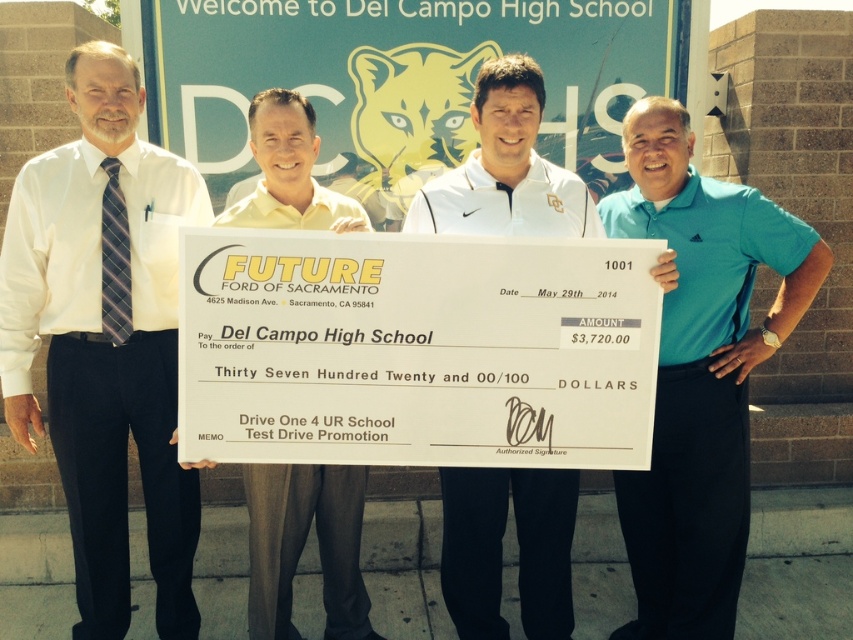
Can you confirm if white matte shirt at center is positioned to the left of yellow shirt at center?

Incorrect, white matte shirt at center is not on the left side of yellow shirt at center.

You are a GUI agent. You are given a task and a screenshot of the screen. Output one action in this format:
    pyautogui.click(x=<x>, y=<y>)
    Task: Click on the white matte shirt at center
    This screenshot has height=640, width=853.
    Given the screenshot: What is the action you would take?
    pyautogui.click(x=502, y=548)

Can you confirm if teal polo shirt at right is thinner than yellow shirt at center?

Incorrect, teal polo shirt at right's width is not less than yellow shirt at center's.

Who is higher up, teal polo shirt at right or yellow shirt at center?

teal polo shirt at right is higher up.

In the scene shown: Who is more distant from viewer, [668,579] or [341,630]?

Point [668,579]

Image resolution: width=853 pixels, height=640 pixels. I want to click on teal polo shirt at right, so click(699, 371).

Is point (91, 230) farther from viewer compared to point (569, 579)?

No, (91, 230) is in front of (569, 579).

Between white shirt at left and white matte shirt at center, which one has more height?

white shirt at left

The image size is (853, 640). Describe the element at coordinates (105, 339) in the screenshot. I see `white shirt at left` at that location.

Identify the location of white shirt at left. (105, 339).